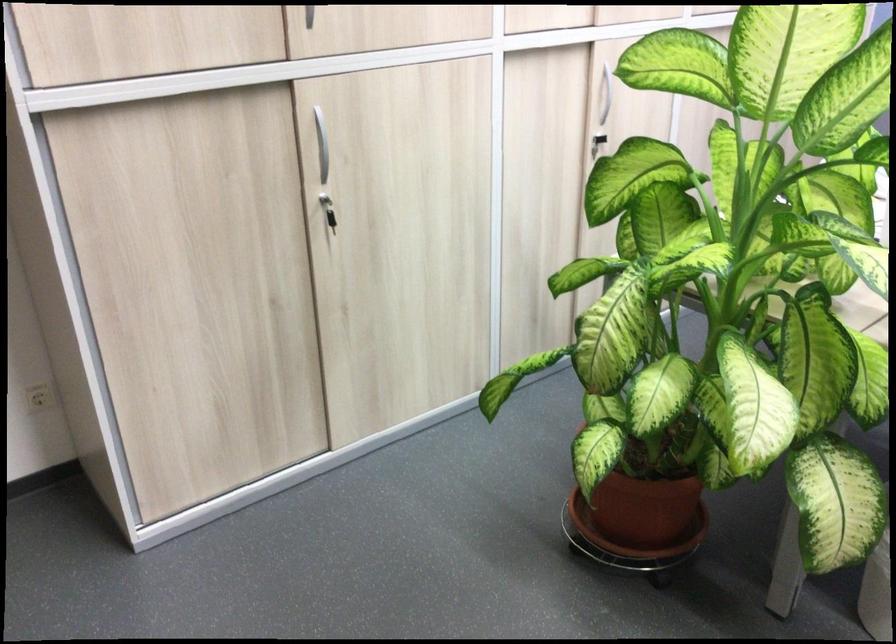
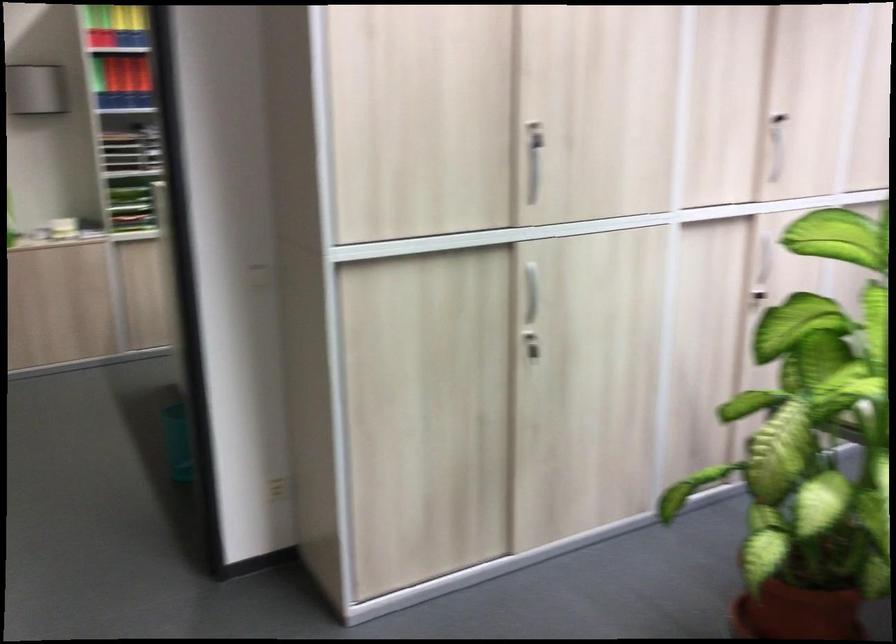
Where in the second image is the point corresponding to (322,147) from the first image?

(531, 292)